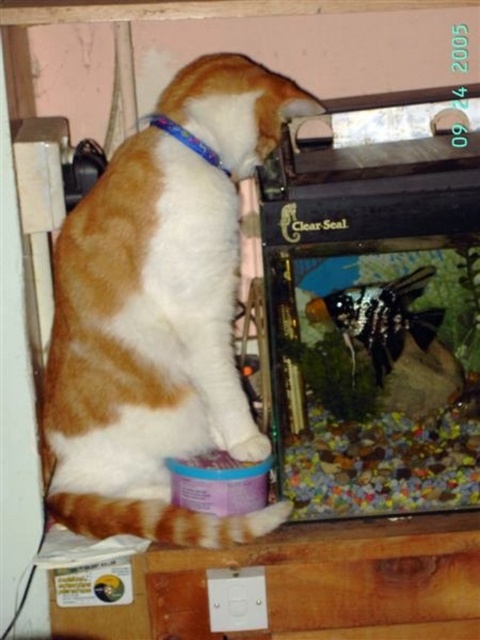
Is orange and white fur cat at center wider than black glossy fish at center?

Correct, the width of orange and white fur cat at center exceeds that of black glossy fish at center.

In the scene shown: Is orange and white fur cat at center above black glossy fish at center?

Yes, orange and white fur cat at center is above black glossy fish at center.

The image size is (480, 640). I want to click on orange and white fur cat at center, so click(x=160, y=310).

Where is `orange and white fur cat at center`? The height and width of the screenshot is (640, 480). orange and white fur cat at center is located at coordinates (160, 310).